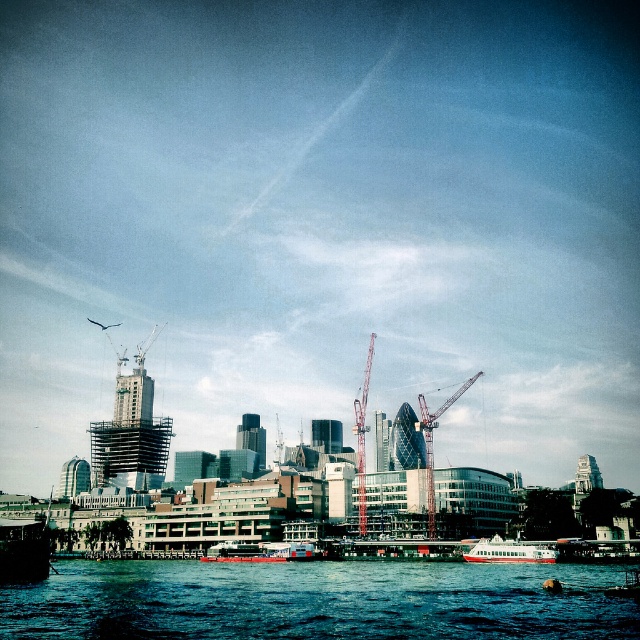
Who is taller, metallic red crane at center or metallic silver boat at lower right?

Standing taller between the two is metallic red crane at center.

Between point (362, 474) and point (609, 589), which one is positioned behind?

Point (362, 474)

Looking at this image, who is more distant from viewer, (371, 332) or (636, 589)?

The point (371, 332) is more distant.

This screenshot has width=640, height=640. I want to click on metallic red crane at center, so click(x=362, y=438).

Who is positioned more to the left, metallic construction crane at center or metallic silver boat at lower right?

Positioned to the left is metallic silver boat at lower right.

Is metallic construction crane at center to the right of metallic silver boat at lower right from the viewer's perspective?

Correct, you'll find metallic construction crane at center to the right of metallic silver boat at lower right.

Is point (429, 438) farther from viewer compared to point (637, 588)?

That is True.

Locate an element on the screen. metallic construction crane at center is located at coordinates (432, 444).

Is white glossy boat at lower center shorter than metallic construction crane at center?

Yes, white glossy boat at lower center is shorter than metallic construction crane at center.

Measure the distance between white glossy boat at lower center and camera.

96.71 meters

I want to click on white glossy boat at lower center, so click(x=508, y=552).